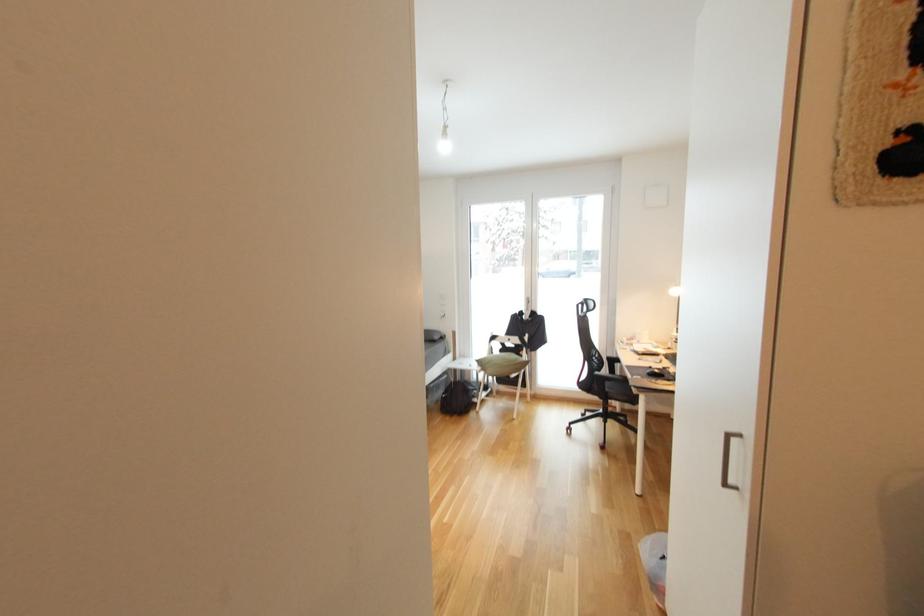
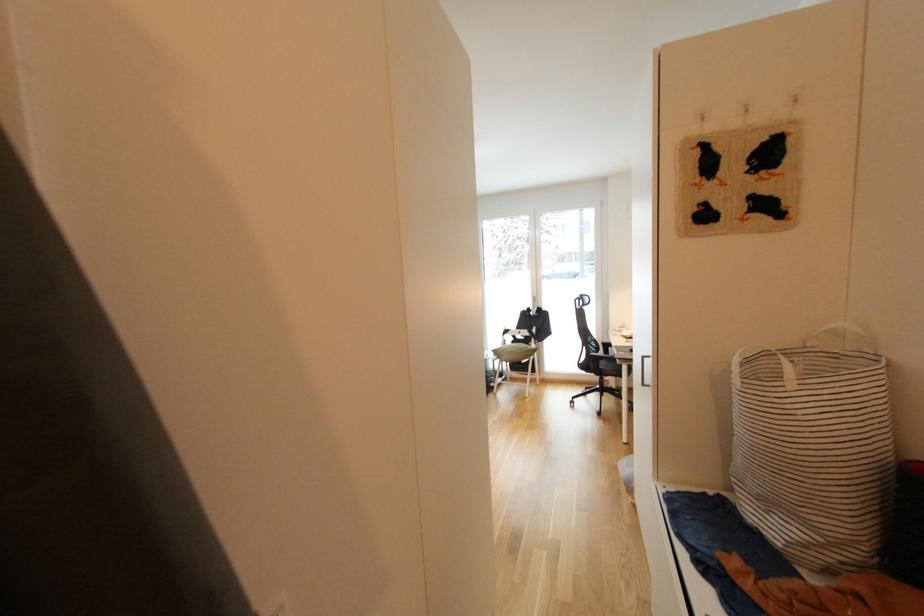
Question: The images are taken continuously from a first-person perspective. In which direction is your viewpoint rotating?

Choices:
 (A) Left
 (B) Right
 (C) Up
 (D) Down

Answer: (A)